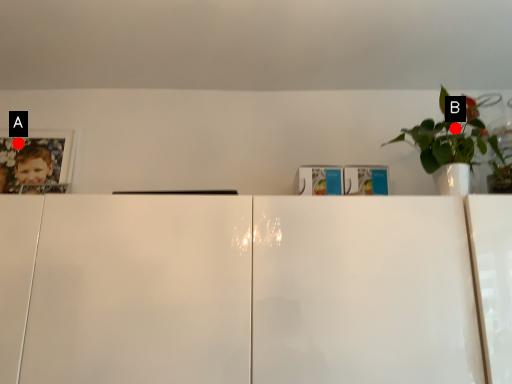
Question: Two points are circled on the image, labeled by A and B beside each circle. Which point appears closest to the camera in this image?

Choices:
 (A) A is closer
 (B) B is closer

Answer: (B)